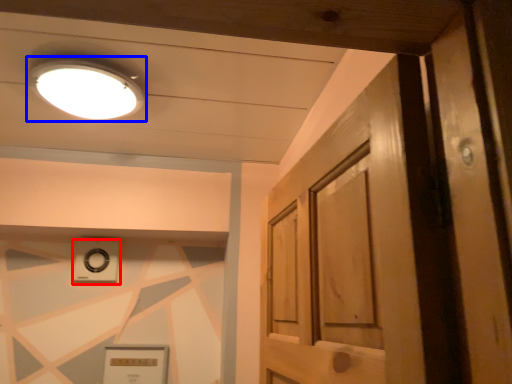
Question: Which object is further to the camera taking this photo, knob (highlighted by a red box) or lighting (highlighted by a blue box)?

Choices:
 (A) knob
 (B) lighting

Answer: (A)